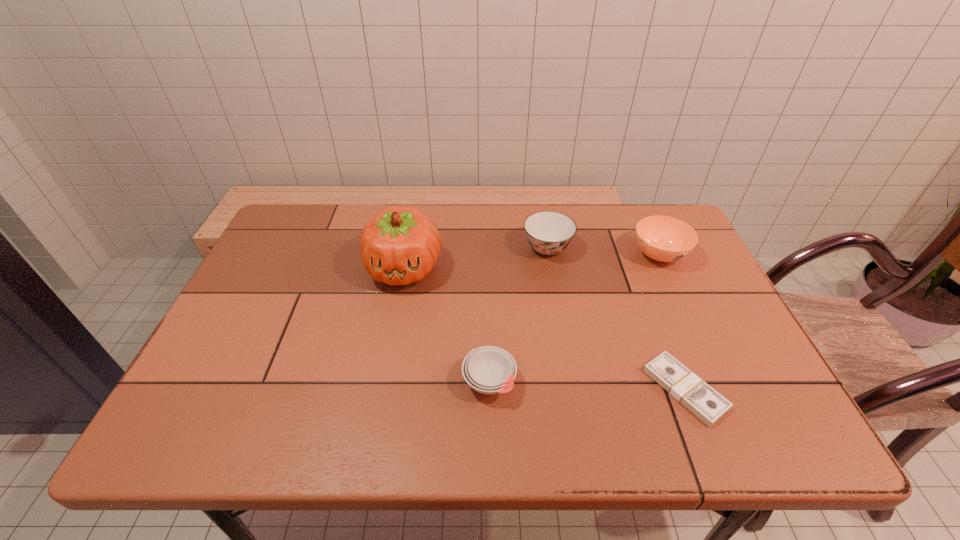
Locate an element on the screen. vacant region that satisfies the following two spatial constraints: 1. on the side of the shortest object with the cute face; 2. on the right side of the leftmost object is located at coordinates (381, 389).

At what (x,y) coordinates should I click in order to perform the action: click on vacant area that satisfies the following two spatial constraints: 1. on the side of the leftmost object with the cute face; 2. on the right side of the dollar. Please return your answer as a coordinate pair (x, y). Looking at the image, I should click on click(x=381, y=389).